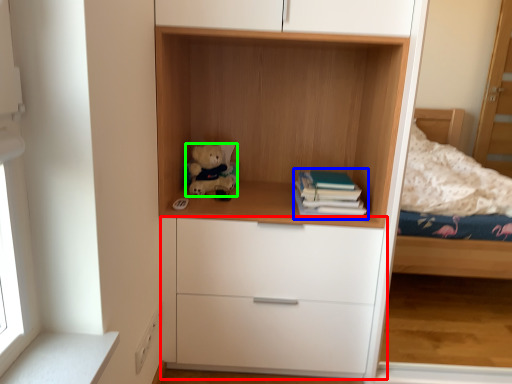
Question: Which object is positioned farthest from chest of drawers (highlighted by a red box)? Select from paperback book (highlighted by a blue box) and teddy bear (highlighted by a green box).

Choices:
 (A) paperback book
 (B) teddy bear

Answer: (B)